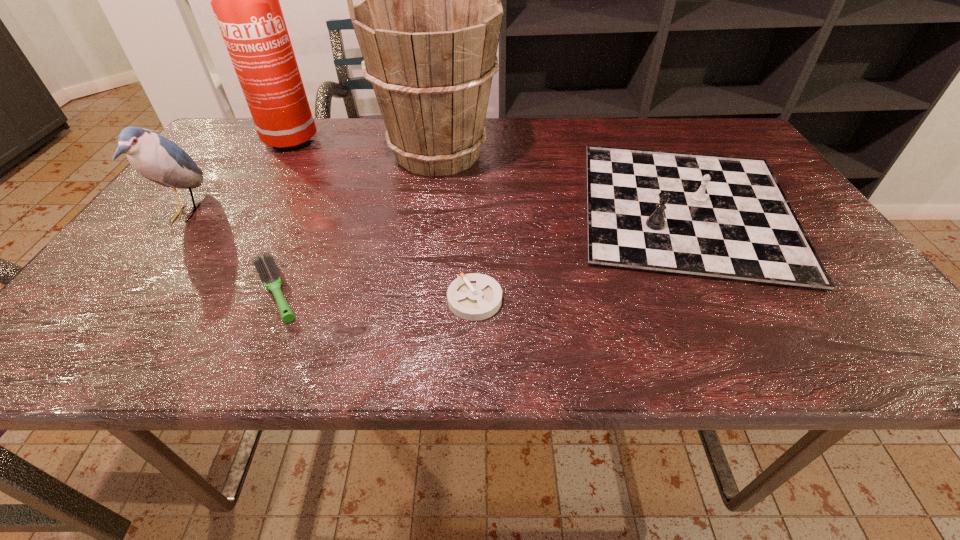
Find the location of a particular element. This screenshot has height=540, width=960. bird situated at the left edge is located at coordinates (155, 157).

You are a GUI agent. You are given a task and a screenshot of the screen. Output one action in this format:
    pyautogui.click(x=<x>, y=<y>)
    Task: Click on the object at the right edge
    This screenshot has width=960, height=540.
    Given the screenshot: What is the action you would take?
    pyautogui.click(x=721, y=217)

This screenshot has height=540, width=960. In order to click on object that is at the far left corner in this screenshot , I will do `click(245, 0)`.

The width and height of the screenshot is (960, 540). Find the location of `object at the far right corner`. object at the far right corner is located at coordinates (721, 217).

Locate an element on the screen. free space at the far edge is located at coordinates (276, 150).

What are the coordinates of `vacant space at the left edge of the desktop` in the screenshot? It's located at (201, 252).

The width and height of the screenshot is (960, 540). What are the coordinates of `vacant space at the far left corner` in the screenshot? It's located at click(x=241, y=145).

Where is `unoccupied position between the third tallest object and the fire extinguisher`? unoccupied position between the third tallest object and the fire extinguisher is located at coordinates [232, 177].

Find the location of a particular element. This screenshot has width=960, height=540. vacant region between the third tallest object and the hairbrush is located at coordinates (x=231, y=252).

Locate an element on the screen. free space between the fourth tallest object and the shortest object is located at coordinates (581, 254).